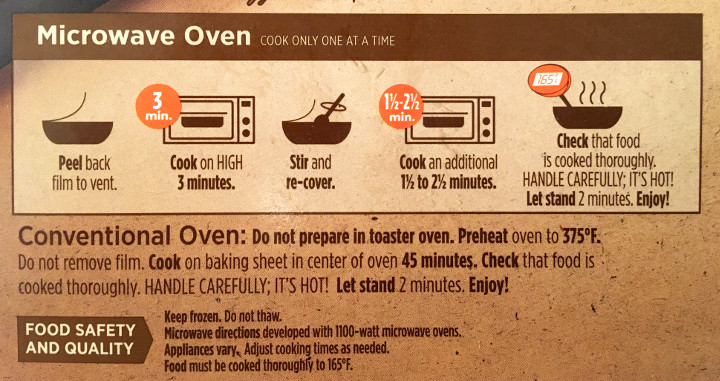
I want to click on type of microwave, so click(325, 326).